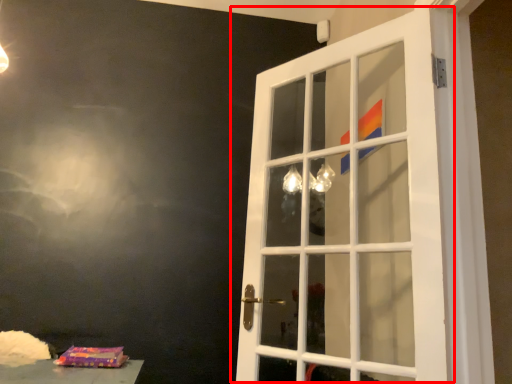
Question: Where is door (annotated by the red box) located in relation to package in the image?

Choices:
 (A) left
 (B) right

Answer: (B)